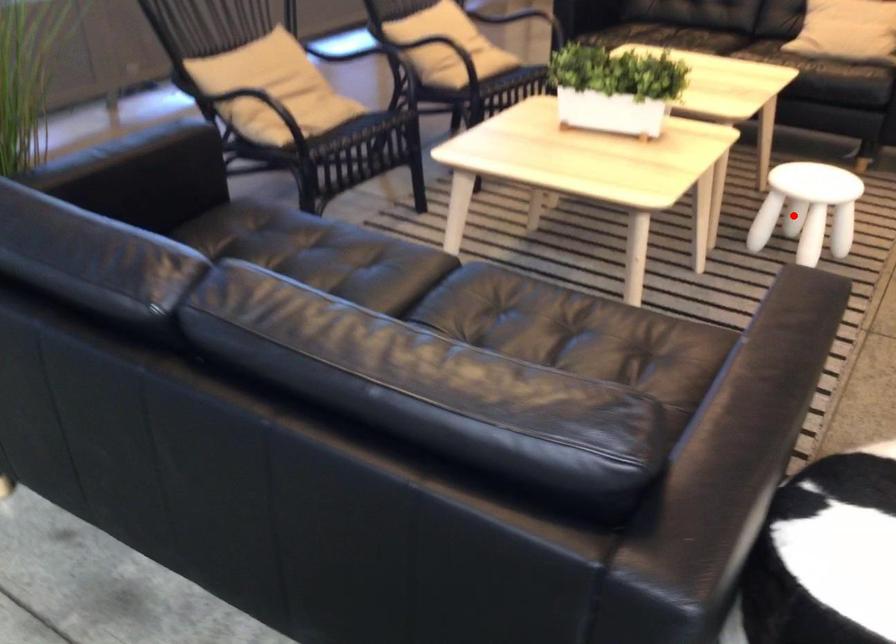
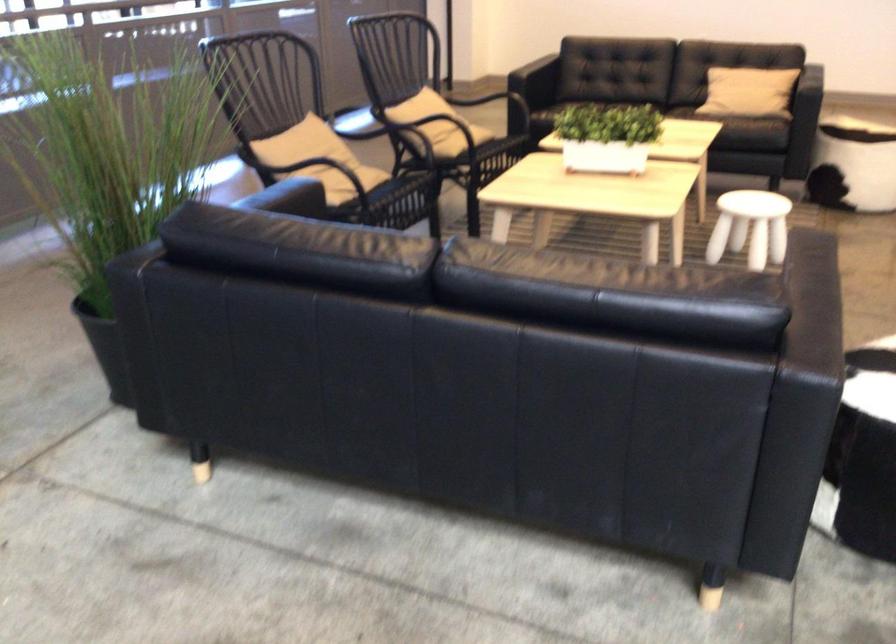
Locate, in the second image, the point that corresponds to the highlighted location in the first image.

(750, 227)